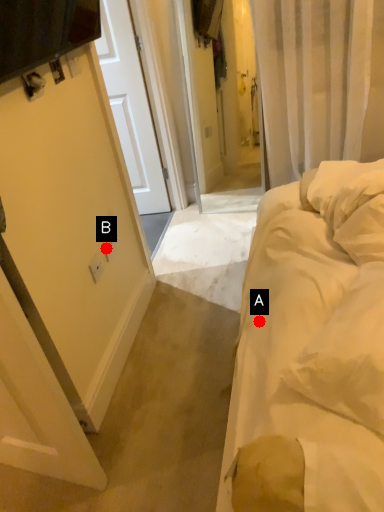
Question: Two points are circled on the image, labeled by A and B beside each circle. Which point is farther to the camera?

Choices:
 (A) A is further
 (B) B is further

Answer: (B)